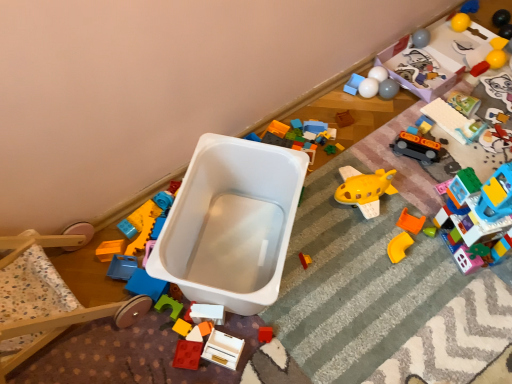
The image size is (512, 384). What are the coordinates of `free area in between orange matte plastic corner piece at lower right, the eighth toy positioned from the left, and white plastic toy at center, which is the third toy from left to right` in the screenshot? It's located at (325, 276).